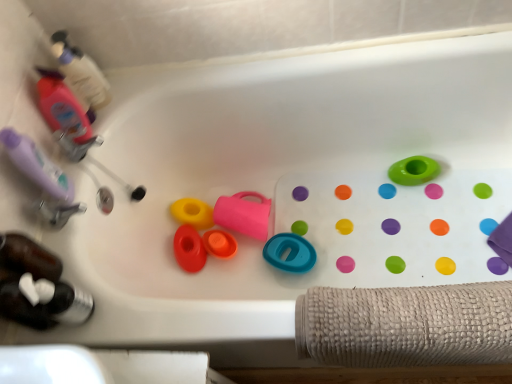
I want to click on vacant space to the right of green rubber ring at upper right, positioned as the sixth toy in left-to-right order, so click(472, 180).